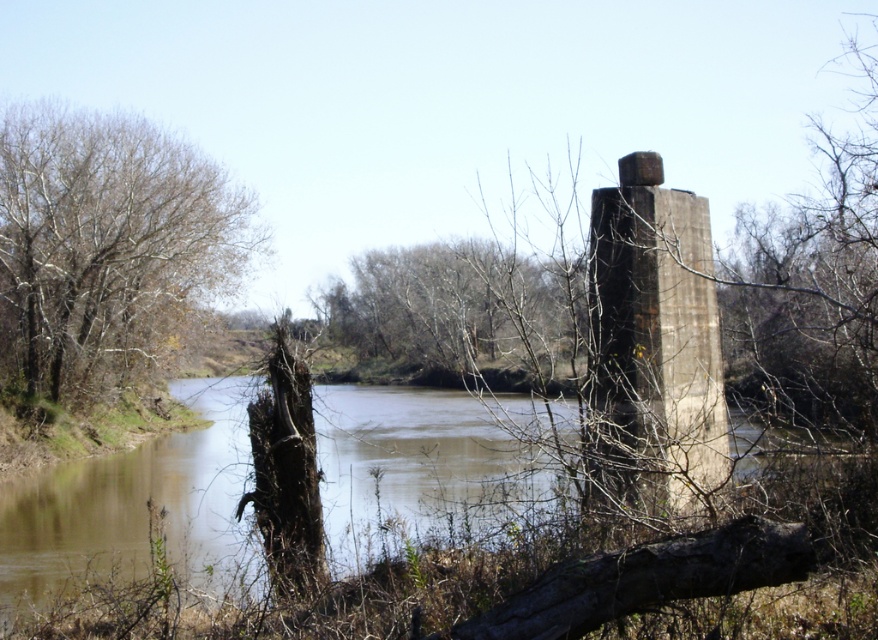
Question: Can you confirm if concrete/rough pillar at right is positioned to the left of bare wood tree at center?

Choices:
 (A) no
 (B) yes

Answer: (A)

Question: Which is nearer to the concrete/rough pillar at right?

Choices:
 (A) brown leafless tree at left
 (B) bare wood tree at center

Answer: (B)

Question: Does brown leafless tree at left appear under brown muddy water at center?

Choices:
 (A) no
 (B) yes

Answer: (A)

Question: Which of these objects is positioned closest to the bare wood tree at center?

Choices:
 (A) brown muddy water at center
 (B) concrete/rough pillar at right

Answer: (A)

Question: Is brown leafless tree at left below concrete/rough pillar at right?

Choices:
 (A) yes
 (B) no

Answer: (B)

Question: Which point is farther to the camera?

Choices:
 (A) (137, 252)
 (B) (515, 339)
 (C) (666, 349)
 (D) (200, 524)

Answer: (A)